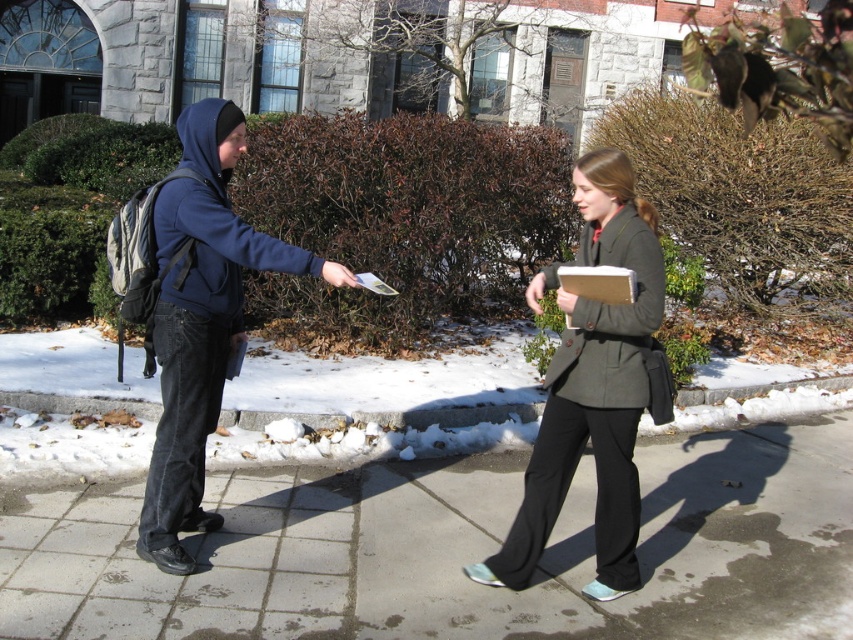
Question: Which point is farther from the camera taking this photo?

Choices:
 (A) (660, 317)
 (B) (202, 269)
 (C) (643, 451)

Answer: (C)

Question: Where is concrete sidewalk at center located in relation to matte blue hoodie at left in the image?

Choices:
 (A) above
 (B) below

Answer: (B)

Question: Is concrete sidewalk at center closer to the viewer compared to dark gray wool coat at center?

Choices:
 (A) yes
 (B) no

Answer: (A)

Question: Considering the real-world distances, which object is closest to the dark gray wool coat at center?

Choices:
 (A) matte blue hoodie at left
 (B) concrete sidewalk at center

Answer: (A)

Question: Which of the following is the closest to the observer?

Choices:
 (A) concrete sidewalk at center
 (B) matte blue hoodie at left
 (C) matte gray blazer at center

Answer: (A)

Question: Observing the image, what is the correct spatial positioning of concrete sidewalk at center in reference to matte blue hoodie at left?

Choices:
 (A) below
 (B) above

Answer: (A)